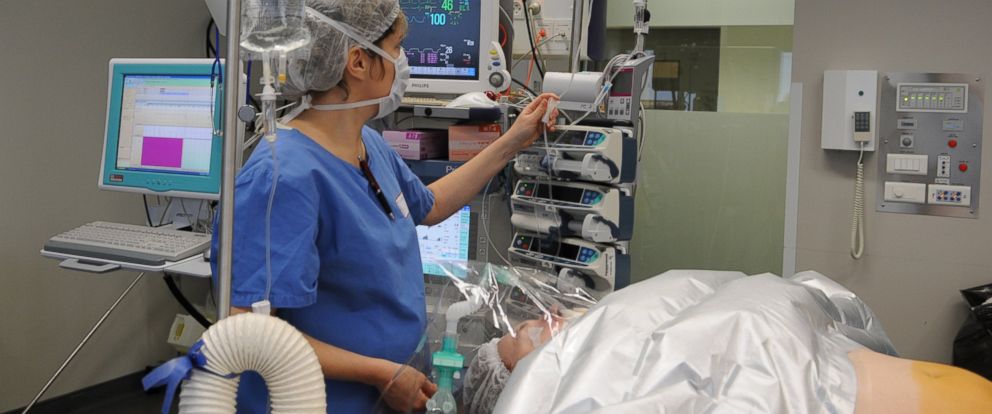
The height and width of the screenshot is (414, 992). Find the location of `keyboard`. keyboard is located at coordinates (108, 236).